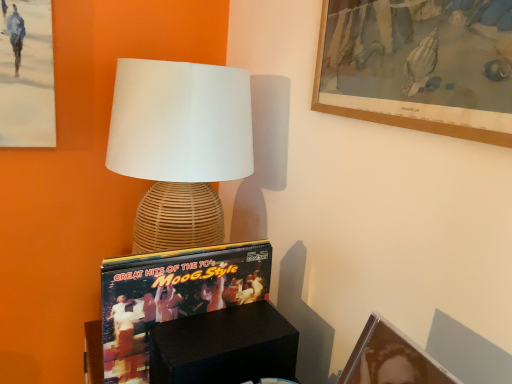
Question: Is point (368, 339) closer or farther from the camera than point (379, 8)?

Choices:
 (A) closer
 (B) farther

Answer: (A)

Question: In terms of height, does matte black picture frame at lower right, the second picture frame in the top-to-bottom sequence, look taller or shorter compared to wooden picture frame at upper right, which is the 2th picture frame from bottom to top?

Choices:
 (A) short
 (B) tall

Answer: (A)

Question: Which object is positioned farthest from the black matte box at lower center?

Choices:
 (A) matte black picture frame at lower right, the 1th picture frame in the bottom-to-top sequence
 (B) woven rattan lamp at center
 (C) wooden picture frame at upper right, the 1th picture frame viewed from the top

Answer: (C)

Question: Which is farther from the black matte box at lower center?

Choices:
 (A) wooden picture frame at upper right, which is the 2th picture frame from bottom to top
 (B) woven rattan lamp at center
 (C) matte black picture frame at lower right, the 1th picture frame in the bottom-to-top sequence

Answer: (A)